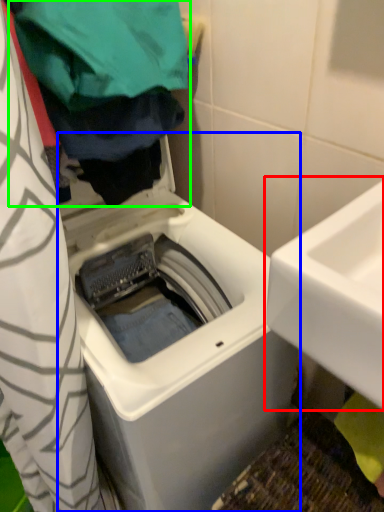
Question: Which is farther away from sink (highlighted by a red box)? washing machine (highlighted by a blue box) or clothing (highlighted by a green box)?

Choices:
 (A) washing machine
 (B) clothing

Answer: (B)